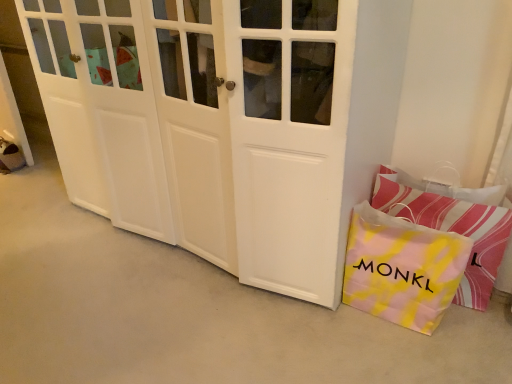
This screenshot has height=384, width=512. What are the coordinates of `vacant space situated above pink striped pillow at lower right (from a real-world perspective)` in the screenshot? It's located at (440, 190).